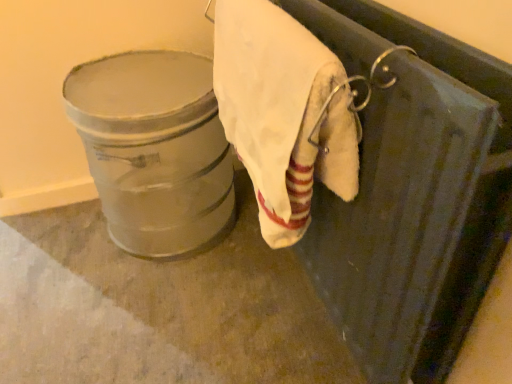
Measure the distance between metallic silver bucket at left and camera.

metallic silver bucket at left is 1.06 meters from camera.

Image resolution: width=512 pixels, height=384 pixels. What do you see at coordinates (154, 149) in the screenshot?
I see `metallic silver bucket at left` at bounding box center [154, 149].

The image size is (512, 384). In order to click on metallic silver bucket at left in this screenshot , I will do `click(154, 149)`.

Image resolution: width=512 pixels, height=384 pixels. Find the location of `white cotton towel at upper right`. white cotton towel at upper right is located at coordinates (283, 113).

This screenshot has width=512, height=384. What do you see at coordinates (283, 113) in the screenshot?
I see `white cotton towel at upper right` at bounding box center [283, 113].

Measure the distance between white cotton towel at upper right and camera.

white cotton towel at upper right and camera are 21.68 inches apart.

Locate an element on the screen. metallic silver bucket at left is located at coordinates (154, 149).

Can you confirm if metallic silver bucket at left is positioned to the right of white cotton towel at upper right?

In fact, metallic silver bucket at left is to the left of white cotton towel at upper right.

Is metallic silver bucket at left further to the viewer compared to white cotton towel at upper right?

Yes, metallic silver bucket at left is further from the camera.

Considering the points (164, 215) and (286, 157), which point is in front, point (164, 215) or point (286, 157)?

Point (286, 157)

From the image's perspective, is metallic silver bucket at left above or below white cotton towel at upper right?

metallic silver bucket at left is below white cotton towel at upper right.

From a real-world perspective, is metallic silver bucket at left located higher than white cotton towel at upper right?

Actually, metallic silver bucket at left is physically below white cotton towel at upper right in the real world.

From the picture: Which object is wider, metallic silver bucket at left or white cotton towel at upper right?

metallic silver bucket at left.

Is metallic silver bucket at left taller than white cotton towel at upper right?

Correct, metallic silver bucket at left is much taller as white cotton towel at upper right.

Which of these two, metallic silver bucket at left or white cotton towel at upper right, is smaller?

white cotton towel at upper right is smaller.

Does metallic silver bucket at left contain white cotton towel at upper right?

No, white cotton towel at upper right is located outside of metallic silver bucket at left.

Is there a large distance between metallic silver bucket at left and white cotton towel at upper right?

No, metallic silver bucket at left is in close proximity to white cotton towel at upper right.

Is metallic silver bucket at left oriented towards white cotton towel at upper right?

Yes, metallic silver bucket at left is aimed at white cotton towel at upper right.

What's the angular difference between metallic silver bucket at left and white cotton towel at upper right's facing directions?

metallic silver bucket at left and white cotton towel at upper right are facing 88.6 degrees away from each other.

Locate an element on the screen. This screenshot has width=512, height=384. lift located on the left of white cotton towel at upper right is located at coordinates (154, 149).

Which object is positioned more to the left, white cotton towel at upper right or metallic silver bucket at left?

From the viewer's perspective, metallic silver bucket at left appears more on the left side.

Relative to metallic silver bucket at left, is white cotton towel at upper right in front or behind?

In the image, white cotton towel at upper right appears in front of metallic silver bucket at left.

Is point (331, 157) closer or farther from the camera than point (137, 183)?

Point (331, 157).

From the image's perspective, does white cotton towel at upper right appear lower than metallic silver bucket at left?

Actually, white cotton towel at upper right appears above metallic silver bucket at left in the image.

From a real-world perspective, is white cotton towel at upper right physically above metallic silver bucket at left?

Yes, from a real-world perspective, white cotton towel at upper right is over metallic silver bucket at left

Considering the relative sizes of white cotton towel at upper right and metallic silver bucket at left in the image provided, is white cotton towel at upper right thinner than metallic silver bucket at left?

Indeed, white cotton towel at upper right has a lesser width compared to metallic silver bucket at left.

Considering the sizes of white cotton towel at upper right and metallic silver bucket at left in the image, is white cotton towel at upper right taller or shorter than metallic silver bucket at left?

In the image, white cotton towel at upper right appears to be shorter than metallic silver bucket at left.

Looking at the image, does white cotton towel at upper right seem bigger or smaller compared to metallic silver bucket at left?

Clearly, white cotton towel at upper right is smaller in size than metallic silver bucket at left.

Is metallic silver bucket at left inside white cotton towel at upper right?

Actually, metallic silver bucket at left is outside white cotton towel at upper right.

Is white cotton towel at upper right next to metallic silver bucket at left and touching it?

No, white cotton towel at upper right is not beside metallic silver bucket at left.

Could you tell me if white cotton towel at upper right is facing metallic silver bucket at left?

No, white cotton towel at upper right is not oriented towards metallic silver bucket at left.

Find the location of a particular element. This screenshot has width=512, height=384. towel on the right of metallic silver bucket at left is located at coordinates (283, 113).

Where is `lift below the white cotton towel at upper right (from the image's perspective)`? lift below the white cotton towel at upper right (from the image's perspective) is located at coordinates (154, 149).

The height and width of the screenshot is (384, 512). I want to click on towel on the right of metallic silver bucket at left, so click(283, 113).